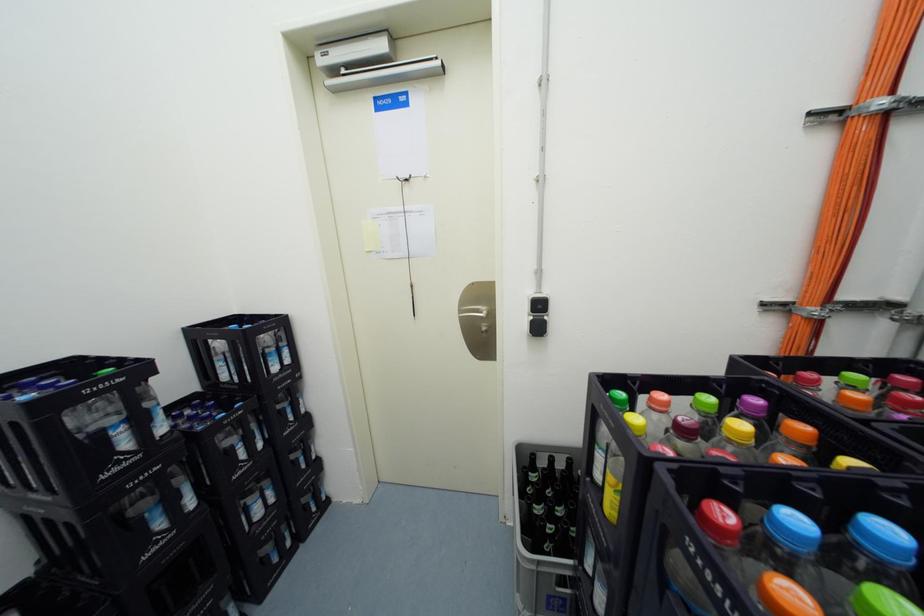
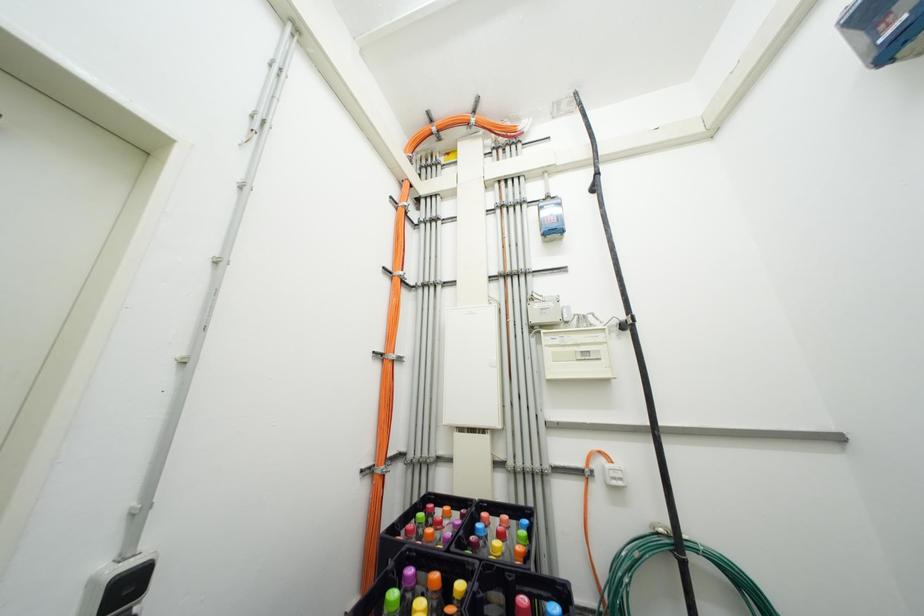
First-person continuous shooting, in which direction is the camera rotating?

The camera's rotation is toward right-up.